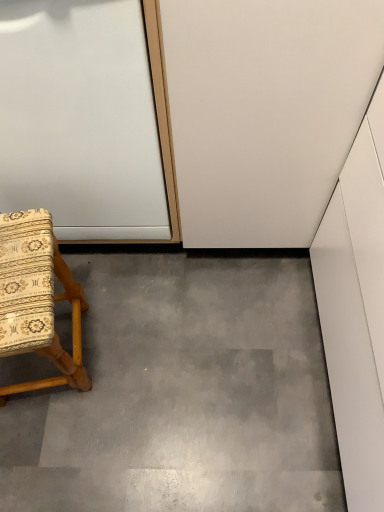
At what (x,y) coordinates should I click in order to perform the action: click on blank space situated above gray concrete at lower left (from a real-world perspective). Please return your answer as a coordinate pair (x, y). Looking at the image, I should click on 177,362.